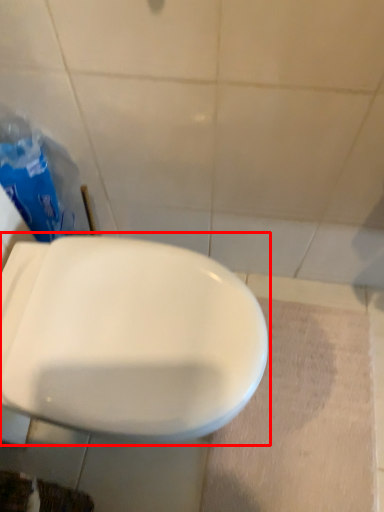
Question: From the image's perspective, considering the relative positions of toilet (annotated by the red box) and garbage in the image provided, where is toilet (annotated by the red box) located with respect to the staircase?

Choices:
 (A) above
 (B) below

Answer: (B)